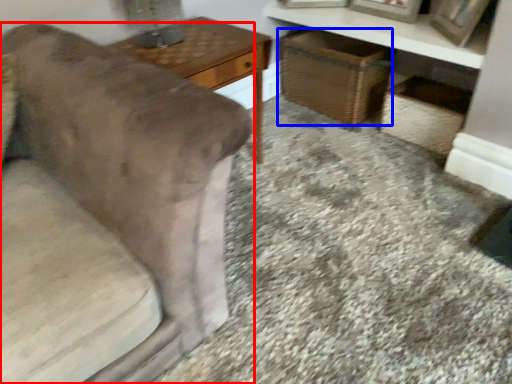
Question: Among these objects, which one is farthest to the camera, furniture (highlighted by a red box) or basket (highlighted by a blue box)?

Choices:
 (A) furniture
 (B) basket

Answer: (B)